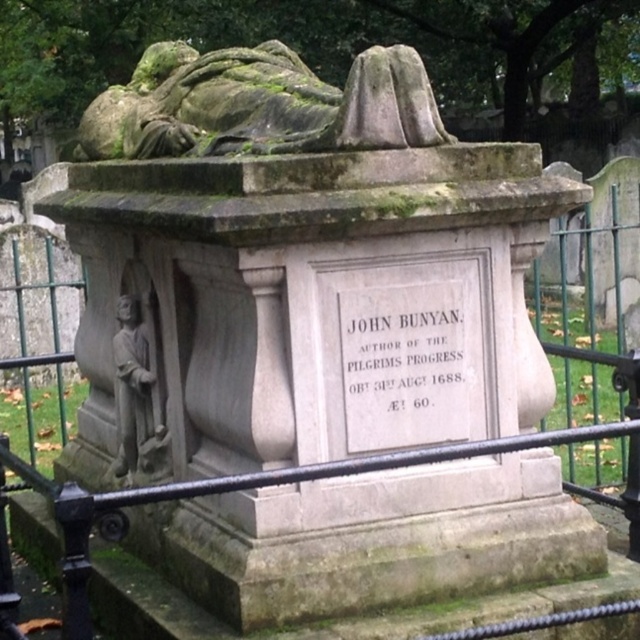
Question: Which point is farther to the camera?

Choices:
 (A) (88, 106)
 (B) (136, 445)
 (C) (161, 595)

Answer: (A)

Question: Observing the image, what is the correct spatial positioning of black metal fence at center in reference to stone statue at left?

Choices:
 (A) below
 (B) above

Answer: (B)

Question: Which of the following is the closest to the observer?

Choices:
 (A) (310, 262)
 (B) (122, 129)
 (C) (136, 317)

Answer: (A)

Question: Which object is farther from the camera taking this photo?

Choices:
 (A) black metal fence at center
 (B) stone statue at left
 (C) green mossy stone sculpture at upper center

Answer: (B)

Question: In this image, where is black metal fence at center located relative to stone statue at left?

Choices:
 (A) right
 (B) left

Answer: (A)

Question: Can you confirm if black metal fence at center is positioned to the left of stone statue at left?

Choices:
 (A) no
 (B) yes

Answer: (A)